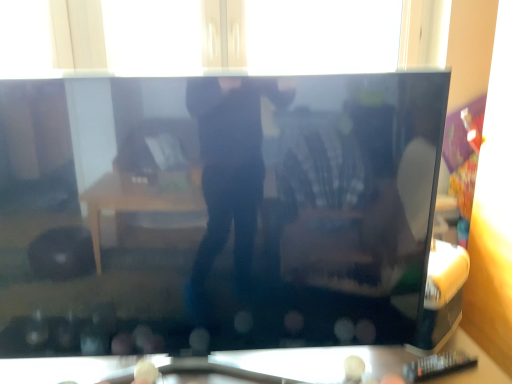
Question: Does black glossy television at center have a larger size compared to transparent glass window at upper center?

Choices:
 (A) yes
 (B) no

Answer: (A)

Question: Is black glossy television at center at the left side of transparent glass window at upper center?

Choices:
 (A) no
 (B) yes

Answer: (B)

Question: Can you confirm if black glossy television at center is smaller than transparent glass window at upper center?

Choices:
 (A) no
 (B) yes

Answer: (A)

Question: From the image's perspective, is black glossy television at center over transparent glass window at upper center?

Choices:
 (A) yes
 (B) no

Answer: (B)

Question: Can you confirm if black glossy television at center is shorter than transparent glass window at upper center?

Choices:
 (A) no
 (B) yes

Answer: (A)

Question: Is transparent glass window at upper center inside the boundaries of transparent glass table at lower center, or outside?

Choices:
 (A) inside
 (B) outside

Answer: (B)

Question: Considering the positions of point (275, 21) and point (318, 377), is point (275, 21) closer or farther from the camera than point (318, 377)?

Choices:
 (A) closer
 (B) farther

Answer: (B)

Question: Visually, is transparent glass window at upper center positioned to the left or to the right of transparent glass table at lower center?

Choices:
 (A) right
 (B) left

Answer: (A)

Question: Relative to transparent glass table at lower center, is transparent glass window at upper center in front or behind?

Choices:
 (A) front
 (B) behind

Answer: (B)

Question: Does point (1, 319) appear closer or farther from the camera than point (290, 46)?

Choices:
 (A) closer
 (B) farther

Answer: (A)

Question: Is black glossy television at center bigger or smaller than transparent glass window at upper center?

Choices:
 (A) small
 (B) big

Answer: (B)

Question: In the image, is black glossy television at center on the left side or the right side of transparent glass window at upper center?

Choices:
 (A) right
 (B) left

Answer: (B)

Question: Would you say black glossy television at center is inside or outside transparent glass window at upper center?

Choices:
 (A) outside
 (B) inside

Answer: (A)

Question: Is transparent glass table at lower center wider or thinner than black glossy television at center?

Choices:
 (A) thin
 (B) wide

Answer: (A)

Question: Is transparent glass table at lower center inside the boundaries of black glossy television at center, or outside?

Choices:
 (A) inside
 (B) outside

Answer: (B)